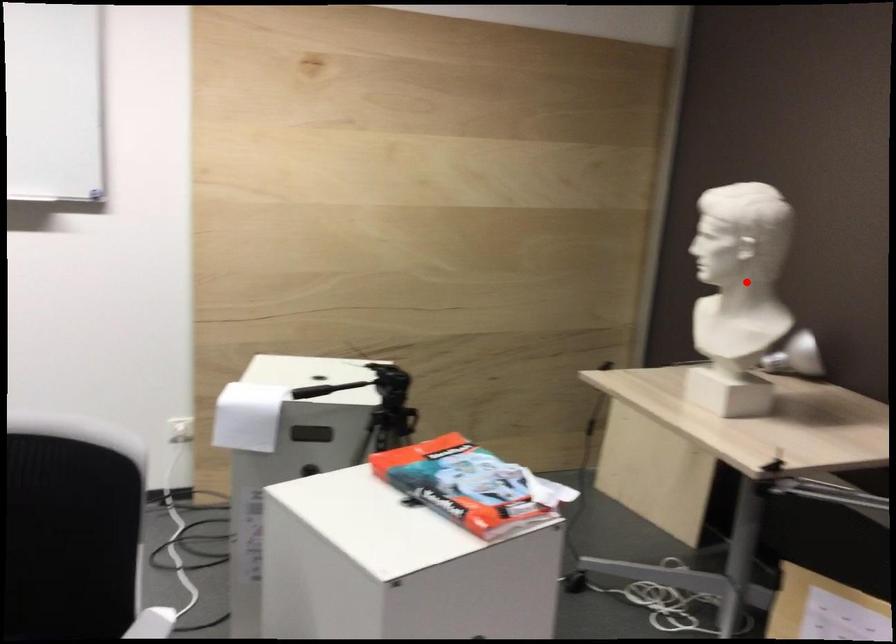
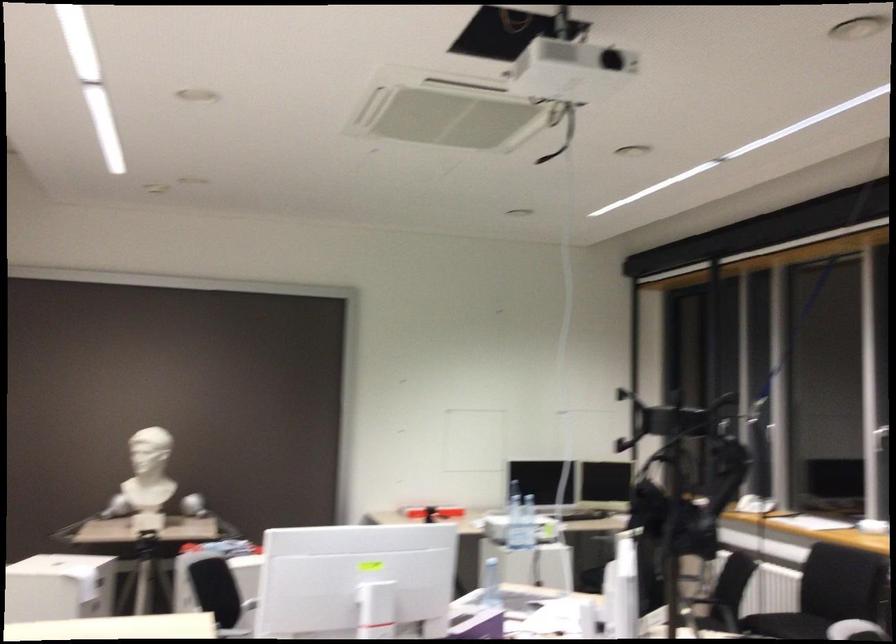
In the second image, find the point that corresponds to the highlighted location in the first image.

(179, 457)